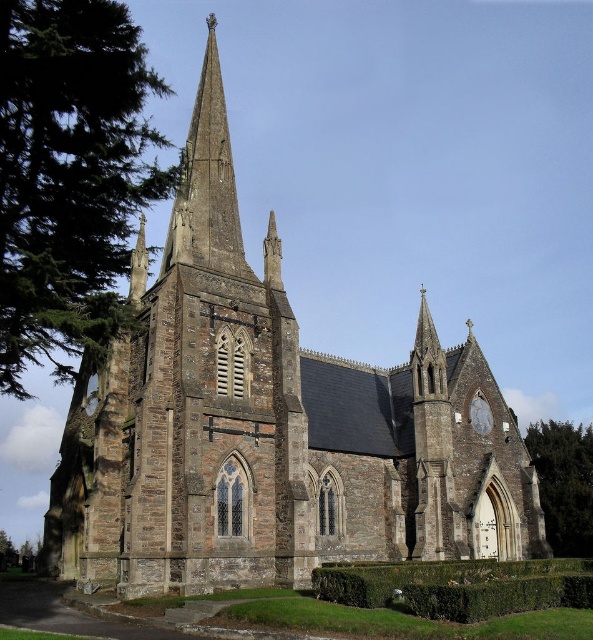
Based on the photo, can you confirm if green leafy tree at upper left is positioned below smooth stone spire at upper center?

Correct, green leafy tree at upper left is located below smooth stone spire at upper center.

Who is positioned more to the right, green leafy tree at upper left or smooth stone spire at upper center?

smooth stone spire at upper center is more to the right.

Which is in front, point (52, 84) or point (192, 128)?

Point (52, 84) is more forward.

The image size is (593, 640). I want to click on green leafy tree at upper left, so click(x=69, y=177).

Is green leafy tree at lower right smaller than white stone clock at upper right?

No, green leafy tree at lower right is not smaller than white stone clock at upper right.

This screenshot has height=640, width=593. Describe the element at coordinates (563, 483) in the screenshot. I see `green leafy tree at lower right` at that location.

The height and width of the screenshot is (640, 593). In order to click on green leafy tree at lower right in this screenshot , I will do `click(563, 483)`.

The image size is (593, 640). Find the location of `green leafy tree at upper left`. green leafy tree at upper left is located at coordinates (69, 177).

Which of these two, green leafy tree at upper left or white stone clock at upper right, stands shorter?

white stone clock at upper right is shorter.

Locate an element on the screen. This screenshot has height=640, width=593. green leafy tree at upper left is located at coordinates (69, 177).